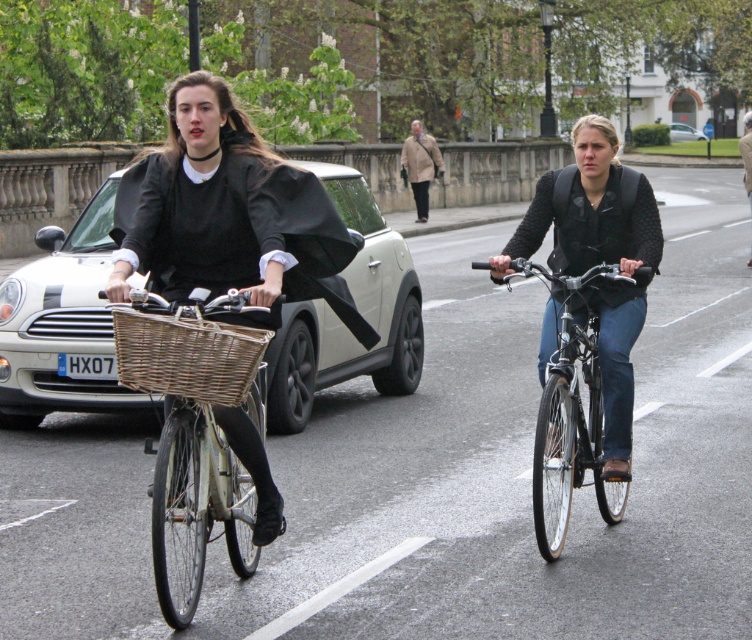
Where is `matte wicker basket at center`? The image size is (752, 640). matte wicker basket at center is located at coordinates pyautogui.click(x=440, y=476).

Is point (226, 609) farther from camera compared to point (211, 488)?

Yes, it is behind point (211, 488).

You are a GUI agent. You are given a task and a screenshot of the screen. Output one action in this format:
    pyautogui.click(x=<x>, y=<y>)
    Task: Click on the matte wicker basket at center
    The image size is (752, 640).
    Given the screenshot: What is the action you would take?
    pyautogui.click(x=440, y=476)

Can you confirm if wooden wicker basket at left is bigger than shiny silver bicycle at center?

No, wooden wicker basket at left is not bigger than shiny silver bicycle at center.

Measure the distance between wooden wicker basket at left and shiny silver bicycle at center.

They are 1.73 meters apart.

Who is more distant from viewer, (249, 524) or (587, 273)?

Positioned behind is point (587, 273).

Find the location of a particular element. wooden wicker basket at left is located at coordinates (193, 433).

Which is behind, point (743, 124) or point (702, 132)?

Positioned behind is point (702, 132).

Does white fabric umbrella at upper center have a lesser height compared to white matte car at center?

Incorrect, white fabric umbrella at upper center's height does not fall short of white matte car at center's.

This screenshot has width=752, height=640. Describe the element at coordinates (746, 154) in the screenshot. I see `white fabric umbrella at upper center` at that location.

In order to click on white fabric umbrella at upper center in this screenshot , I will do click(x=746, y=154).